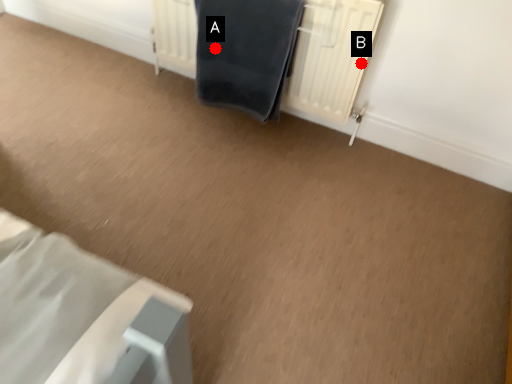
Question: Two points are circled on the image, labeled by A and B beside each circle. Which point is closer to the camera taking this photo?

Choices:
 (A) A is closer
 (B) B is closer

Answer: (B)